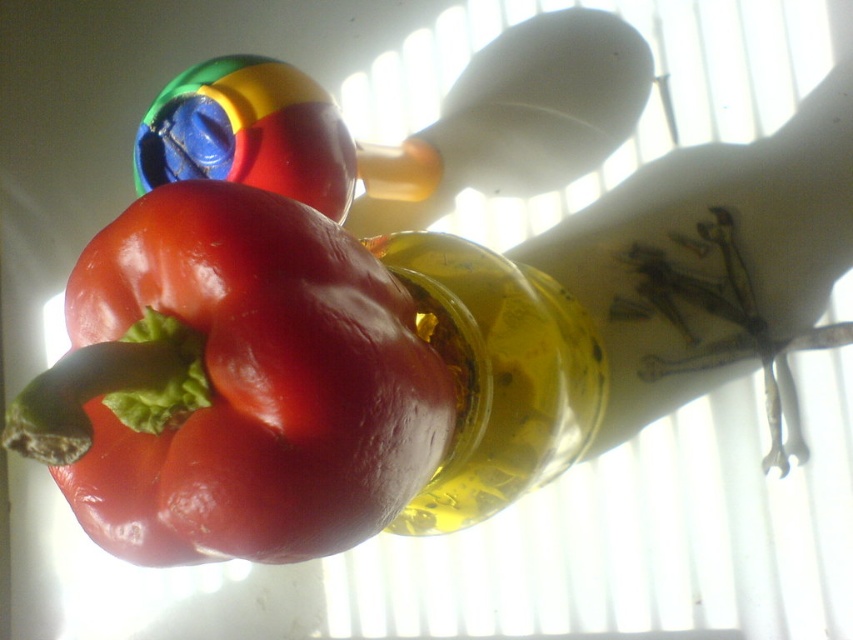
Question: Which point is closer to the camera taking this photo?

Choices:
 (A) (466, 396)
 (B) (260, 164)

Answer: (A)

Question: Which object appears farthest from the camera in this image?

Choices:
 (A) translucent yellow bottle at center
 (B) shiny red bell pepper at center
 (C) shiny plastic ball at upper center

Answer: (C)

Question: Which object is closer to the camera taking this photo?

Choices:
 (A) shiny plastic ball at upper center
 (B) shiny red bell pepper at center
 (C) translucent yellow bottle at center

Answer: (B)

Question: Does translucent yellow bottle at center appear over shiny plastic ball at upper center?

Choices:
 (A) yes
 (B) no

Answer: (B)

Question: Does shiny red bell pepper at center lie behind shiny plastic ball at upper center?

Choices:
 (A) no
 (B) yes

Answer: (A)

Question: Does shiny red bell pepper at center appear over shiny plastic ball at upper center?

Choices:
 (A) no
 (B) yes

Answer: (A)